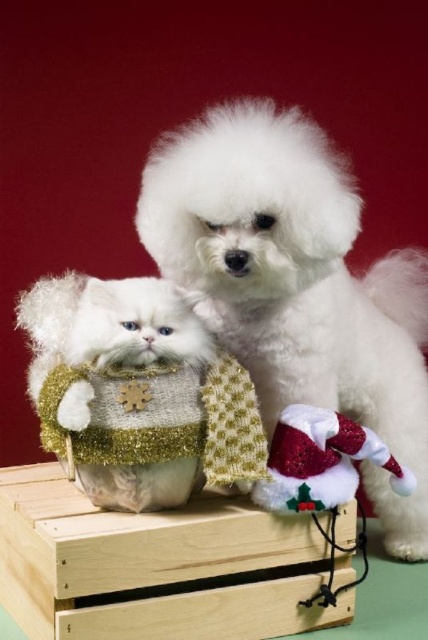
You are standing 5 feet away from the point at coordinates point (347,410). Can you reach it without moving your feet?

The distance of point (347,410) from camera is 4.27 feet, so since you are standing 5 feet away from it, you cannot reach it without moving your feet.